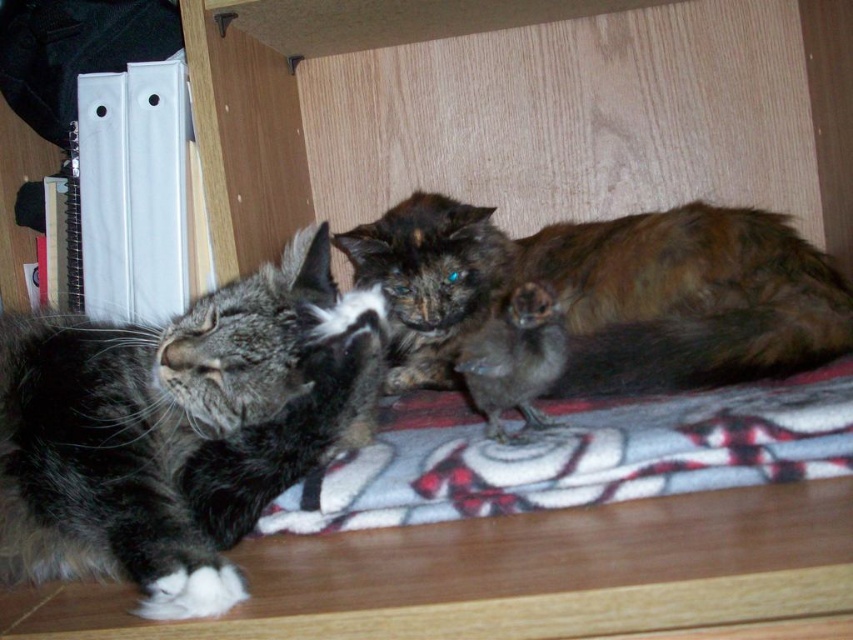
Which is more to the right, fluffy brown cat at center or plaid fleece blanket at center?

From the viewer's perspective, fluffy brown cat at center appears more on the right side.

Measure the distance from fluffy brown cat at center to plaid fleece blanket at center.

7.03 inches

Is point (485, 216) positioned in front of point (695, 410)?

No, it is behind (695, 410).

Locate an element on the screen. Image resolution: width=853 pixels, height=640 pixels. fluffy brown cat at center is located at coordinates (611, 292).

Which of these two, gray fluffy cat at left or fluffy brown cat at center, stands shorter?

fluffy brown cat at center

From the picture: Does gray fluffy cat at left have a greater width compared to fluffy brown cat at center?

No, gray fluffy cat at left is not wider than fluffy brown cat at center.

Based on the photo, measure the distance between gray fluffy cat at left and camera.

gray fluffy cat at left is 20.04 inches from camera.

Identify the location of gray fluffy cat at left. (178, 428).

Is gray fluffy cat at left taller than plaid fleece blanket at center?

Yes.

Does gray fluffy cat at left have a lesser height compared to plaid fleece blanket at center?

No.

Does point (204, 536) come in front of point (735, 433)?

Yes, point (204, 536) is in front of point (735, 433).

You are a GUI agent. You are given a task and a screenshot of the screen. Output one action in this format:
    pyautogui.click(x=<x>, y=<y>)
    Task: Click on the gray fluffy cat at left
    The width and height of the screenshot is (853, 640).
    Given the screenshot: What is the action you would take?
    pyautogui.click(x=178, y=428)